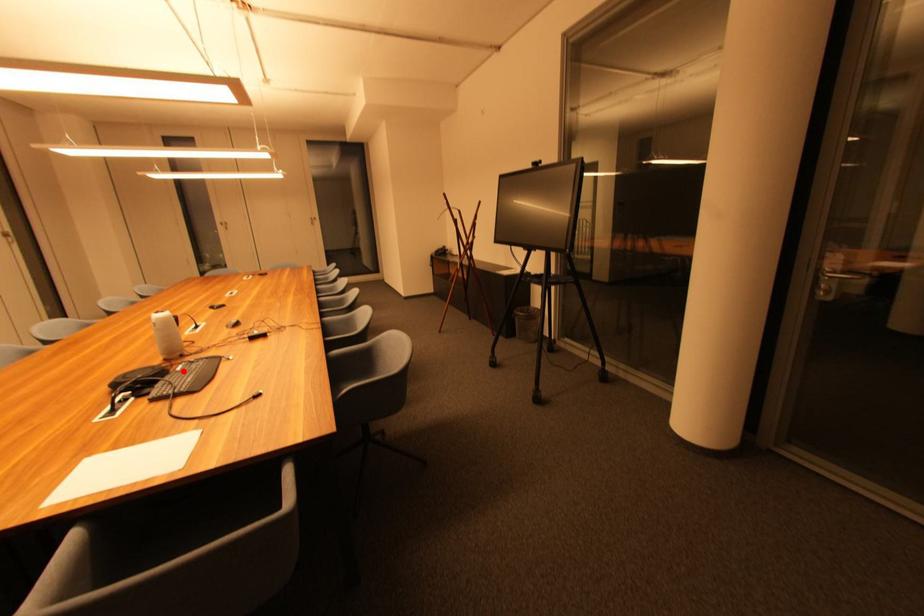
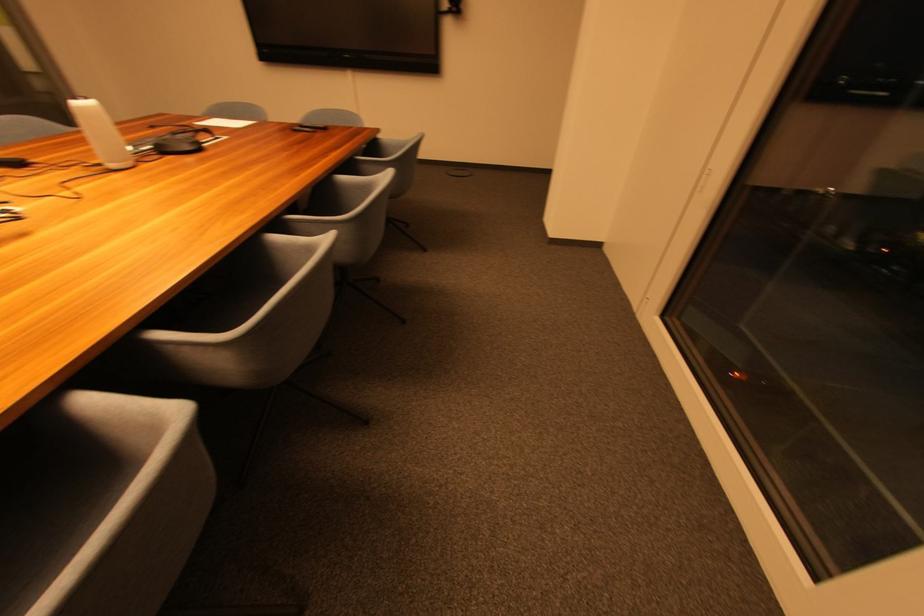
Question: I am providing you with two images of the same scene from different viewpoints. A red point is marked on the first image. Can you still see the location of the red point in image 2?

Choices:
 (A) Yes
 (B) No

Answer: (B)